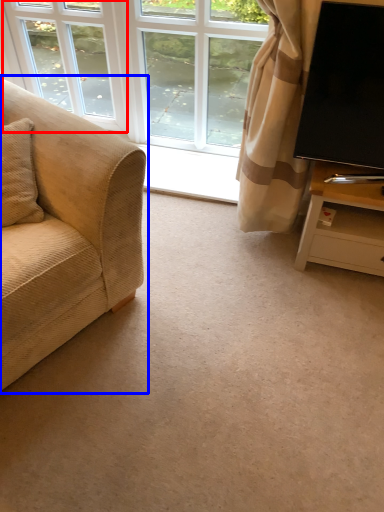
Question: Which object appears closest to the camera in this image, window (highlighted by a red box) or studio couch (highlighted by a blue box)?

Choices:
 (A) window
 (B) studio couch

Answer: (B)